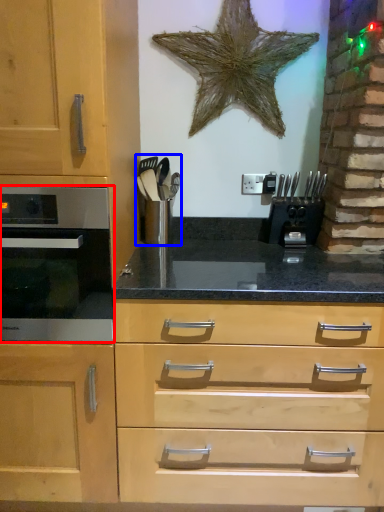
Question: Which point is further to the camera, oven (highlighted by a red box) or appliance (highlighted by a blue box)?

Choices:
 (A) oven
 (B) appliance

Answer: (B)